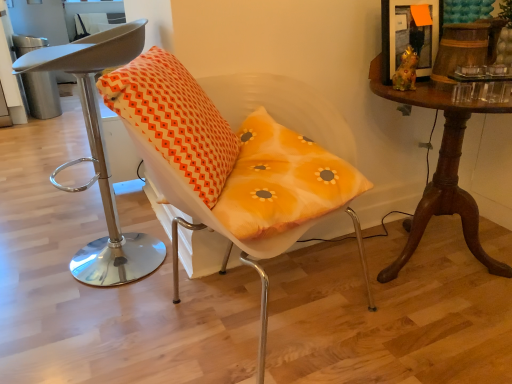
Question: Is orange printed cushion at center wider than matte orange cushion at center, the first chair positioned from the right?

Choices:
 (A) no
 (B) yes

Answer: (A)

Question: Is orange printed cushion at center smaller than matte orange cushion at center, arranged as the 2th chair when viewed from the left?

Choices:
 (A) no
 (B) yes

Answer: (B)

Question: Considering the relative positions of orange printed cushion at center and matte orange cushion at center, the first chair positioned from the right, in the image provided, is orange printed cushion at center to the right of matte orange cushion at center, the first chair positioned from the right, from the viewer's perspective?

Choices:
 (A) no
 (B) yes

Answer: (A)

Question: Is orange printed cushion at center far from matte orange cushion at center, the first chair positioned from the right?

Choices:
 (A) yes
 (B) no

Answer: (B)

Question: Does orange printed cushion at center have a greater height compared to matte orange cushion at center, the first chair positioned from the right?

Choices:
 (A) no
 (B) yes

Answer: (A)

Question: Considering the positions of orange printed cushion at center and matte orange cushion at center, the first chair positioned from the right, in the image, is orange printed cushion at center bigger or smaller than matte orange cushion at center, the first chair positioned from the right,?

Choices:
 (A) small
 (B) big

Answer: (A)

Question: Would you say orange printed cushion at center is to the left or to the right of matte orange cushion at center, arranged as the 2th chair when viewed from the left, in the picture?

Choices:
 (A) left
 (B) right

Answer: (A)

Question: Considering their positions, is orange printed cushion at center located in front of or behind matte orange cushion at center, the first chair positioned from the right?

Choices:
 (A) front
 (B) behind

Answer: (B)

Question: From the image's perspective, relative to matte orange cushion at center, the first chair positioned from the right, is orange printed cushion at center above or below?

Choices:
 (A) below
 (B) above

Answer: (B)

Question: From a real-world perspective, is matte orange cushion at center, the first chair positioned from the right, physically located above or below mahogany wood table at right?

Choices:
 (A) above
 (B) below

Answer: (A)

Question: In terms of width, does matte orange cushion at center, the first chair positioned from the right, look wider or thinner when compared to mahogany wood table at right?

Choices:
 (A) wide
 (B) thin

Answer: (A)

Question: Is matte orange cushion at center, arranged as the 2th chair when viewed from the left, spatially inside mahogany wood table at right, or outside of it?

Choices:
 (A) outside
 (B) inside

Answer: (A)

Question: Is matte orange cushion at center, arranged as the 2th chair when viewed from the left, in front of or behind mahogany wood table at right in the image?

Choices:
 (A) front
 (B) behind

Answer: (A)

Question: From a real-world perspective, relative to mahogany wood table at right, is orange printed cushion at center vertically above or below?

Choices:
 (A) above
 (B) below

Answer: (A)

Question: In terms of width, does orange printed cushion at center look wider or thinner when compared to mahogany wood table at right?

Choices:
 (A) thin
 (B) wide

Answer: (A)